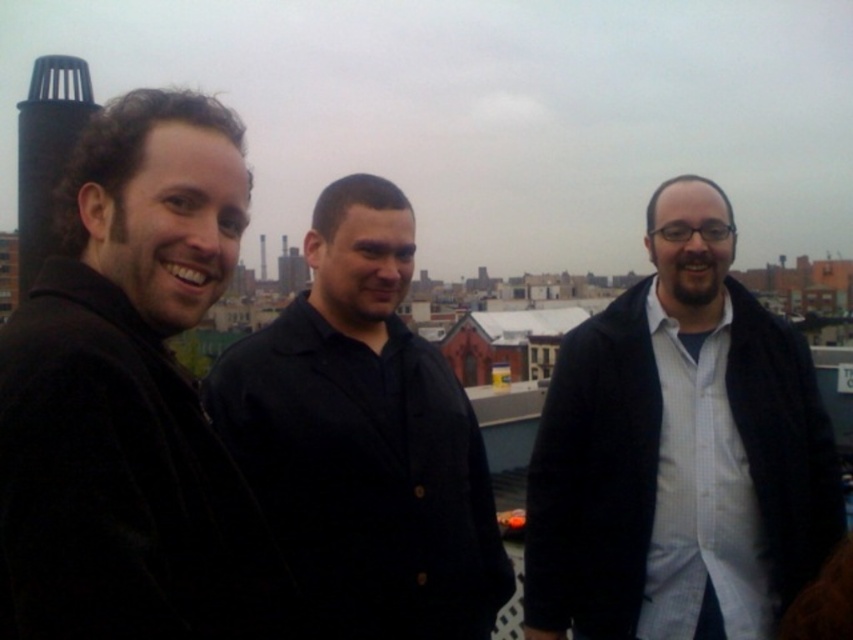
Is white matte jacket at center bigger than black matte shirt at center?

Correct, white matte jacket at center is larger in size than black matte shirt at center.

Does point (601, 461) come closer to viewer compared to point (463, 547)?

Yes, point (601, 461) is in front of point (463, 547).

This screenshot has height=640, width=853. In order to click on white matte jacket at center in this screenshot , I will do `click(679, 452)`.

Does point (173, 304) lie in front of point (705, 332)?

Yes, point (173, 304) is in front of point (705, 332).

Who is positioned more to the right, black velvet jacket at left or white matte jacket at center?

Positioned to the right is white matte jacket at center.

Where is `black velvet jacket at left`? The height and width of the screenshot is (640, 853). black velvet jacket at left is located at coordinates (131, 396).

Does point (213, 605) come closer to viewer compared to point (328, 216)?

That is True.

Where is `black velvet jacket at left`? This screenshot has height=640, width=853. black velvet jacket at left is located at coordinates (131, 396).

At what (x,y) coordinates should I click in order to perform the action: click on black velvet jacket at left. Please return your answer as a coordinate pair (x, y). This screenshot has width=853, height=640. Looking at the image, I should click on [131, 396].